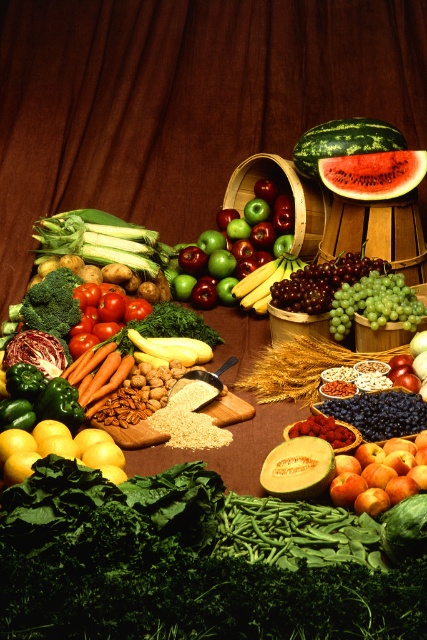
Question: Does green matte grapes at center appear over shiny purple grapes at center?

Choices:
 (A) no
 (B) yes

Answer: (A)

Question: From the image, what is the correct spatial relationship of shiny red apple at center in relation to shiny purple grapes at center?

Choices:
 (A) below
 (B) above

Answer: (A)

Question: Among these objects, which one is nearest to the camera?

Choices:
 (A) brown wooden table at center
 (B) watermelon at center
 (C) smooth red tomato at center
 (D) green shiny grapes at center

Answer: (D)

Question: Considering the real-world distances, which object is farthest from the green matte grapes at center?

Choices:
 (A) watermelon at center
 (B) green matte apples at center
 (C) shiny purple grapes at center

Answer: (B)

Question: Does green matte grapes at center have a larger size compared to green shiny grapes at center?

Choices:
 (A) yes
 (B) no

Answer: (B)

Question: Among these points, which one is farthest from the camera?

Choices:
 (A) (269, 273)
 (B) (333, 499)
 (C) (272, 186)

Answer: (C)